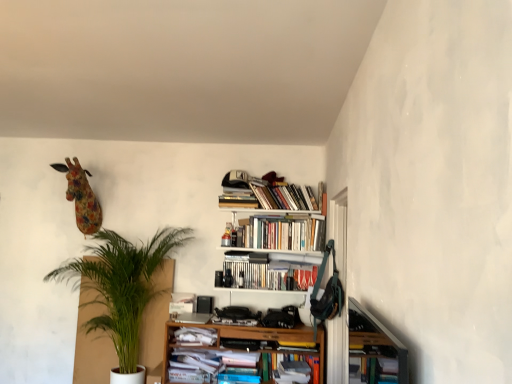
Describe the element at coordinates (295, 370) in the screenshot. I see `hardcover book at center, the 1th book when ordered from bottom to top` at that location.

Find the location of a particular element. Image resolution: width=512 pixels, height=384 pixels. green leafy plant at left is located at coordinates [x=120, y=298].

Measure the distance between point (317, 265) and camera.

The distance of point (317, 265) from camera is 3.20 meters.

Image resolution: width=512 pixels, height=384 pixels. Describe the element at coordinates (195, 336) in the screenshot. I see `white paper at lower center, marked as the 2th book in a bottom-to-top arrangement` at that location.

What is the approximate height of wooden bookshelf at lower right?

13.07 inches.

What do you see at coordinates (387, 338) in the screenshot? I see `wooden bookshelf at lower right` at bounding box center [387, 338].

You are a GUI agent. You are given a task and a screenshot of the screen. Output one action in this format:
    pyautogui.click(x=<x>, y=<y>)
    Task: Click on the floral fabric giraffe at upper left
    The image size is (512, 384).
    Given the screenshot: What is the action you would take?
    pyautogui.click(x=81, y=196)

The height and width of the screenshot is (384, 512). Describe the element at coordinates (282, 196) in the screenshot. I see `hardcover books at upper center, which is the fifth book in bottom-to-top order` at that location.

This screenshot has width=512, height=384. In order to click on hardcover book at center, the 5th book from the top in this screenshot , I will do `click(295, 370)`.

Is wooden bookshelf at lower right behind white paper at lower center, the fourth book when ordered from top to bottom?

No, it is in front of white paper at lower center, the fourth book when ordered from top to bottom.

Is wooden bookshelf at lower right oriented away from white paper at lower center, the fourth book when ordered from top to bottom?

wooden bookshelf at lower right does not have its back to white paper at lower center, the fourth book when ordered from top to bottom.

Which of these two, wooden bookshelf at lower right or white paper at lower center, the fourth book when ordered from top to bottom, is thinner?

wooden bookshelf at lower right is thinner.

Consider the image. From the image's perspective, between hardcover books at upper center, which is counted as the 2th book, starting from the top, and white paper at lower center, marked as the 2th book in a bottom-to-top arrangement, which one is located above?

hardcover books at upper center, which is counted as the 2th book, starting from the top, is shown above in the image.

Is hardcover books at upper center, which is the 4th book from bottom to top, oriented away from white paper at lower center, marked as the 2th book in a bottom-to-top arrangement?

No, hardcover books at upper center, which is the 4th book from bottom to top,'s orientation is not away from white paper at lower center, marked as the 2th book in a bottom-to-top arrangement.

Is hardcover books at upper center, which is the 4th book from bottom to top, far from white paper at lower center, the fourth book when ordered from top to bottom?

That's not correct — hardcover books at upper center, which is the 4th book from bottom to top, is a little close to white paper at lower center, the fourth book when ordered from top to bottom.

Is hardcover books at upper center, which is counted as the 2th book, starting from the top, bigger or smaller than white paper at lower center, marked as the 2th book in a bottom-to-top arrangement?

Considering their sizes, hardcover books at upper center, which is counted as the 2th book, starting from the top, takes up more space than white paper at lower center, marked as the 2th book in a bottom-to-top arrangement.

Is white paper at lower center, marked as the 2th book in a bottom-to-top arrangement, positioned with its back to wooden bookshelf at lower right?

No, white paper at lower center, marked as the 2th book in a bottom-to-top arrangement,'s orientation is not away from wooden bookshelf at lower right.

From the image's perspective, is white paper at lower center, marked as the 2th book in a bottom-to-top arrangement, above wooden bookshelf at lower right?

Incorrect, from the image's perspective, white paper at lower center, marked as the 2th book in a bottom-to-top arrangement, is lower than wooden bookshelf at lower right.

Considering the sizes of objects white paper at lower center, marked as the 2th book in a bottom-to-top arrangement, and wooden bookshelf at lower right in the image provided, who is wider, white paper at lower center, marked as the 2th book in a bottom-to-top arrangement, or wooden bookshelf at lower right?

Wider between the two is white paper at lower center, marked as the 2th book in a bottom-to-top arrangement.

Considering the sizes of objects hardcover books at upper center, which is the 4th book from bottom to top, and hardcover books at center, the 3th book positioned from the bottom, in the image provided, who is wider, hardcover books at upper center, which is the 4th book from bottom to top, or hardcover books at center, the 3th book positioned from the bottom,?

Wider between the two is hardcover books at upper center, which is the 4th book from bottom to top.

Based on the photo, considering the relative positions of hardcover books at upper center, which is the 4th book from bottom to top, and hardcover books at center, the 3th book positioned from the bottom, in the image provided, is hardcover books at upper center, which is the 4th book from bottom to top, to the left of hardcover books at center, the 3th book positioned from the bottom, from the viewer's perspective?

No.

Is point (315, 249) closer to viewer compared to point (276, 274)?

Yes, point (315, 249) is closer to viewer.

From the image's perspective, count 1st books upward from the hardcover books at center, the 3th book positioned from the bottom, and point to it. Please provide its 2D coordinates.

[(281, 234)]

Between hardcover book at center, the 1th book when ordered from bottom to top, and hardcover books at upper center, which is counted as the 2th book, starting from the top, which one has smaller size?

With smaller size is hardcover book at center, the 1th book when ordered from bottom to top.

Is hardcover book at center, the 5th book from the top, not within hardcover books at upper center, which is counted as the 2th book, starting from the top?

That's correct, hardcover book at center, the 5th book from the top, is outside of hardcover books at upper center, which is counted as the 2th book, starting from the top.

Which of these two, hardcover book at center, the 1th book when ordered from bottom to top, or hardcover books at upper center, which is the 4th book from bottom to top, is thinner?

Thinner between the two is hardcover books at upper center, which is the 4th book from bottom to top.

In order to click on the 1st book in front of the hardcover books at upper center, which is the 4th book from bottom to top, starting your count from the anchor in this screenshot , I will do `click(295, 370)`.

Is hardcover books at center, the 3th book from the top, inside the boundaries of white wooden bookshelf at upper center, or outside?

hardcover books at center, the 3th book from the top, is enclosed within white wooden bookshelf at upper center.

From the image's perspective, is hardcover books at center, the 3th book positioned from the bottom, located beneath white wooden bookshelf at upper center?

Yes, from the image's perspective, hardcover books at center, the 3th book positioned from the bottom, is beneath white wooden bookshelf at upper center.

Is point (234, 269) closer or farther from the camera than point (258, 194)?

Point (234, 269) appears to be closer to the viewer than point (258, 194).

Locate an element on the screen. The image size is (512, 384). the 3rd book behind when counting from the white wooden bookshelf at upper center is located at coordinates (269, 270).

Considering the points (53, 271) and (179, 329), which point is in front, point (53, 271) or point (179, 329)?

Point (179, 329)

What's the angular difference between green leafy plant at left and white paper at lower center, the fourth book when ordered from top to bottom,'s facing directions?

The angle between the facing direction of green leafy plant at left and the facing direction of white paper at lower center, the fourth book when ordered from top to bottom, is 1.8 degrees.

Which object is thinner, green leafy plant at left or white paper at lower center, the fourth book when ordered from top to bottom?

With smaller width is white paper at lower center, the fourth book when ordered from top to bottom.

Considering the relative sizes of green leafy plant at left and white paper at lower center, the fourth book when ordered from top to bottom, in the image provided, is green leafy plant at left taller than white paper at lower center, the fourth book when ordered from top to bottom,?

Yes.

Image resolution: width=512 pixels, height=384 pixels. In order to click on book that is the 1st object located behind the wooden bookshelf at lower right in this screenshot , I will do `click(195, 336)`.

Locate an element on the screen. This screenshot has height=384, width=512. the 2nd book below when counting from the hardcover books at upper center, which is counted as the 2th book, starting from the top (from the image's perspective) is located at coordinates click(195, 336).

Looking at the image, which one is located further to white paper at lower center, the fourth book when ordered from top to bottom, white wooden bookshelf at upper center or wooden bookshelf at lower right?

wooden bookshelf at lower right is further to white paper at lower center, the fourth book when ordered from top to bottom.

Consider the image. Which object lies nearer to the anchor point green leafy plant at left, wooden bookshelf at lower right or hardcover book at center, the 5th book from the top?

hardcover book at center, the 5th book from the top, lies closer to green leafy plant at left than the other object.

When comparing their distances from floral fabric giraffe at upper left, does hardcover books at center, the 3th book positioned from the bottom, or white paper at lower center, the fourth book when ordered from top to bottom, seem further?

The object further to floral fabric giraffe at upper left is hardcover books at center, the 3th book positioned from the bottom.

Considering their positions, is floral fabric giraffe at upper left positioned further to white paper at lower center, the fourth book when ordered from top to bottom, than white wooden bookshelf at upper center?

floral fabric giraffe at upper left is positioned further to the anchor white paper at lower center, the fourth book when ordered from top to bottom.

From the image, which object appears to be nearer to white paper at lower center, the fourth book when ordered from top to bottom, hardcover books at center, the 3th book from the top, or hardcover books at upper center, which is the fifth book in bottom-to-top order?

Based on the image, hardcover books at center, the 3th book from the top, appears to be nearer to white paper at lower center, the fourth book when ordered from top to bottom.

Based on their spatial positions, is white wooden bookshelf at upper center or floral fabric giraffe at upper left closer to green leafy plant at left?

Based on the image, floral fabric giraffe at upper left appears to be nearer to green leafy plant at left.

Which object lies nearer to the anchor point hardcover books at upper center, which is counted as the 2th book, starting from the top, hardcover books at center, the 3th book from the top, or floral fabric giraffe at upper left?

hardcover books at center, the 3th book from the top.

Which object lies nearer to the anchor point hardcover books at upper center, which is the fifth book in bottom-to-top order, hardcover books at center, the 3th book positioned from the bottom, or white paper at lower center, the fourth book when ordered from top to bottom?

hardcover books at center, the 3th book positioned from the bottom, is positioned closer to the anchor hardcover books at upper center, which is the fifth book in bottom-to-top order.

Locate an element on the screen. animal between wooden bookshelf at lower right and hardcover books at center, the 3th book positioned from the bottom, from front to back is located at coordinates (81, 196).

Identify the location of bookcase situated between floral fabric giraffe at upper left and hardcover book at center, the 1th book when ordered from bottom to top, from left to right. The height and width of the screenshot is (384, 512). (277, 237).

This screenshot has width=512, height=384. I want to click on houseplant between wooden bookshelf at lower right and hardcover books at upper center, which is the 4th book from bottom to top, in the front-back direction, so click(120, 298).

What are the coordinates of `houseplant situated between floral fabric giraffe at upper left and hardcover books at upper center, which is counted as the 2th book, starting from the top, from left to right` in the screenshot? It's located at [120, 298].